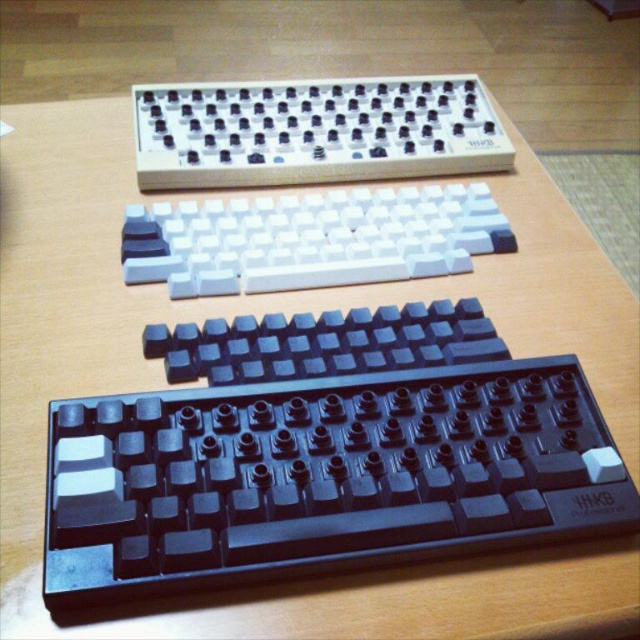
Does black matte keyboard at bottom have a greater height compared to white matte keyboard at center?

Yes, black matte keyboard at bottom is taller than white matte keyboard at center.

Is point (177, 429) closer to viewer compared to point (436, 250)?

Yes, point (177, 429) is in front of point (436, 250).

Where is `black matte keyboard at bottom`? black matte keyboard at bottom is located at coordinates (323, 476).

Does white matte keyboard at upper center lie behind white matte keyboard at center?

Yes.

Can you confirm if white matte keyboard at upper center is taller than white matte keyboard at center?

Yes, white matte keyboard at upper center is taller than white matte keyboard at center.

Which is in front, point (429, 113) or point (161, 205)?

Point (161, 205) is more forward.

Where is `white matte keyboard at upper center`? This screenshot has height=640, width=640. white matte keyboard at upper center is located at coordinates (314, 131).

Can you confirm if black matte keyboard at bottom is taller than white matte keyboard at upper center?

No.

Does black matte keyboard at bottom appear on the right side of white matte keyboard at upper center?

Yes, black matte keyboard at bottom is to the right of white matte keyboard at upper center.

Identify the location of black matte keyboard at bottom. This screenshot has height=640, width=640. (323, 476).